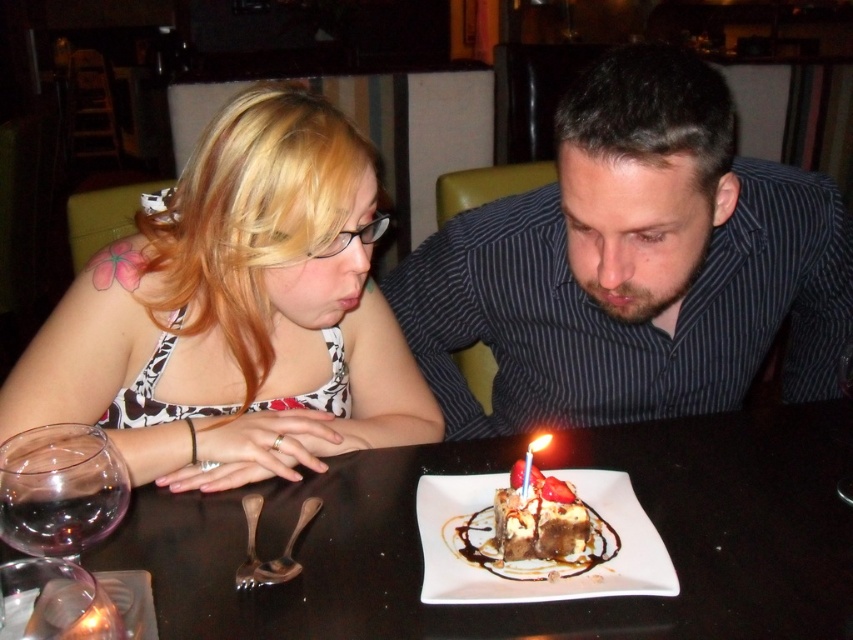
Question: Does matte black shirt at center appear on the left side of chocolate cake at center?

Choices:
 (A) yes
 (B) no

Answer: (B)

Question: Can you confirm if matte black shirt at center is wider than red wax candle at center?

Choices:
 (A) yes
 (B) no

Answer: (A)

Question: Considering the relative positions of chocolate cake at center and red wax candle at center in the image provided, where is chocolate cake at center located with respect to red wax candle at center?

Choices:
 (A) left
 (B) right

Answer: (A)

Question: Which object appears farthest from the camera in this image?

Choices:
 (A) striped shirt at center
 (B) matte black tank top at left
 (C) matte black shirt at center

Answer: (B)

Question: Which is farther from the matte black tank top at left?

Choices:
 (A) chocolate cake at center
 (B) striped shirt at center

Answer: (A)

Question: Which object is farther from the camera taking this photo?

Choices:
 (A) striped shirt at center
 (B) red wax candle at center
 (C) chocolate cake at center
 (D) black glossy table at center

Answer: (C)